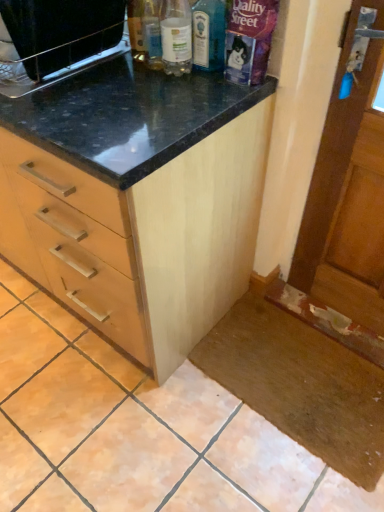
Question: In terms of height, does clear plastic bottle at upper center, the second bottle positioned from the right, look taller or shorter compared to light wood cabinet at center?

Choices:
 (A) tall
 (B) short

Answer: (B)

Question: Based on their positions, is clear plastic bottle at upper center, the second bottle positioned from the right, located to the left or right of light wood cabinet at center?

Choices:
 (A) left
 (B) right

Answer: (B)

Question: Which object is positioned farthest from the translucent glass bottle at center, placed as the second bottle when sorted from left to right?

Choices:
 (A) light wood cabinet at center
 (B) brown wooden screen door at right
 (C) clear plastic bottle at upper center, which ranks as the first bottle in left-to-right order
 (D) black matte microwave at upper left

Answer: (B)

Question: Which of these objects is positioned closest to the brown wooden screen door at right?

Choices:
 (A) clear plastic bottle at upper center, the second bottle positioned from the right
 (B) light wood cabinet at center
 (C) translucent glass bottle at center, placed as the second bottle when sorted from left to right
 (D) black matte microwave at upper left

Answer: (B)